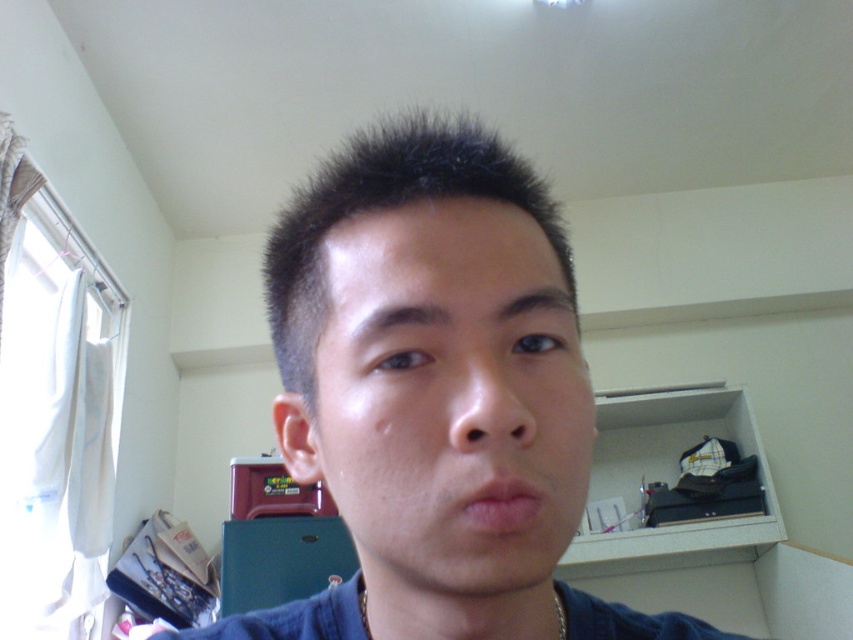
Question: Which point is farther to the camera?

Choices:
 (A) smooth skin face at center
 (B) blue denim shirt at center
 (C) gold chain at lower center
 (D) dark brown spiky hair at center

Answer: (D)

Question: Estimate the real-world distances between objects in this image. Which object is farther from the gold chain at lower center?

Choices:
 (A) blue denim shirt at center
 (B) dark brown spiky hair at center
 (C) smooth skin face at center

Answer: (B)

Question: Is smooth skin face at center bigger than gold chain at lower center?

Choices:
 (A) yes
 (B) no

Answer: (A)

Question: Which object is farther from the camera taking this photo?

Choices:
 (A) blue denim shirt at center
 (B) smooth skin face at center
 (C) gold chain at lower center
 (D) dark brown spiky hair at center

Answer: (D)

Question: Is blue denim shirt at center to the left of smooth skin face at center from the viewer's perspective?

Choices:
 (A) yes
 (B) no

Answer: (A)

Question: Can you confirm if blue denim shirt at center is positioned above smooth skin face at center?

Choices:
 (A) yes
 (B) no

Answer: (B)